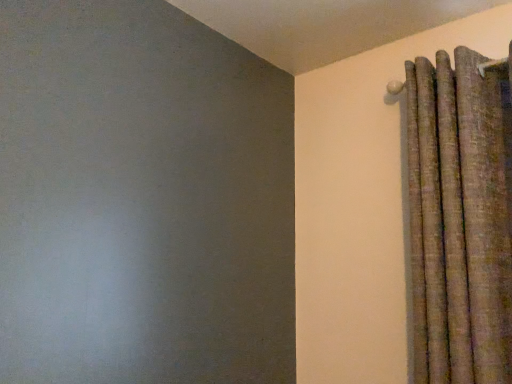
The width and height of the screenshot is (512, 384). Describe the element at coordinates (460, 218) in the screenshot. I see `brown textured curtain at right` at that location.

At what (x,y) coordinates should I click in order to perform the action: click on brown textured curtain at right. Please return your answer as a coordinate pair (x, y). Image resolution: width=512 pixels, height=384 pixels. Looking at the image, I should click on (460, 218).

Locate an element on the screen. This screenshot has height=384, width=512. brown textured curtain at right is located at coordinates (460, 218).